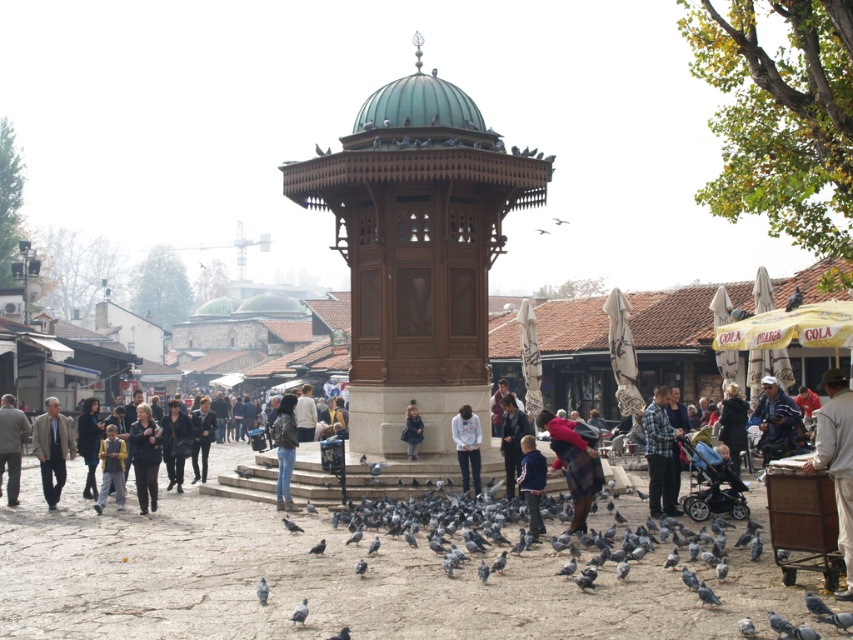
Question: Which point appears farthest from the camera in this image?

Choices:
 (A) (585, 513)
 (B) (546, 230)

Answer: (B)

Question: Which object appears farthest from the camera in this image?

Choices:
 (A) blue denim jacket at center
 (B) white plastic bag at lower right

Answer: (A)

Question: Which of these objects is positioned closest to the leather jacket at center?

Choices:
 (A) white feathered bird at center
 (B) plaid fabric child at center
 (C) gray matte bird at lower center
 (D) gray matte pigeon at center

Answer: (B)

Question: Is wooden gazebo at center positioned behind plaid fabric child at center?

Choices:
 (A) no
 (B) yes

Answer: (B)

Question: Does dark gray leather jacket at lower left lie behind dark blue leather jacket at center?

Choices:
 (A) yes
 (B) no

Answer: (B)

Question: Can you confirm if dark blue leather jacket at center is positioned below feathered grey bird at center?

Choices:
 (A) yes
 (B) no

Answer: (A)